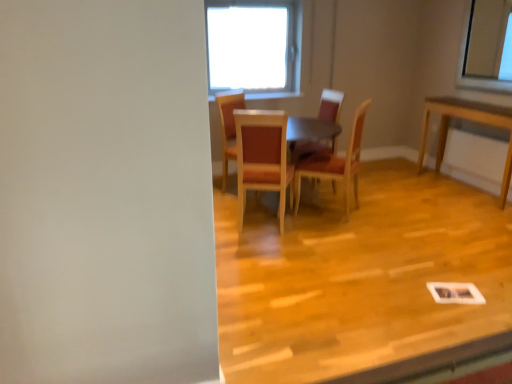
Question: From their relative heights in the image, would you say wooden chair at center, which appears as the third chair when viewed from the left, is taller or shorter than wooden floor at center?

Choices:
 (A) short
 (B) tall

Answer: (B)

Question: Considering the positions of wooden chair at center, which appears as the third chair when viewed from the left, and wooden floor at center in the image, is wooden chair at center, which appears as the third chair when viewed from the left, wider or thinner than wooden floor at center?

Choices:
 (A) thin
 (B) wide

Answer: (A)

Question: Which of these objects is positioned closest to the wooden chair at center, positioned as the second chair in left-to-right order?

Choices:
 (A) wooden chair at center, marked as the first chair in a left-to-right arrangement
 (B) wooden chair at center, the 2th chair positioned from the right
 (C) wooden floor at center
 (D) wooden table at center
 (E) wooden chair at center, the fourth chair when ordered from left to right

Answer: (D)

Question: Which object is the farthest from the wooden chair at center, positioned as the second chair in left-to-right order?

Choices:
 (A) wooden chair at center, the fourth chair when ordered from left to right
 (B) wooden floor at center
 (C) wooden table at center
 (D) wooden chair at center, marked as the first chair in a left-to-right arrangement
 (E) wooden chair at center, the 2th chair positioned from the right

Answer: (E)